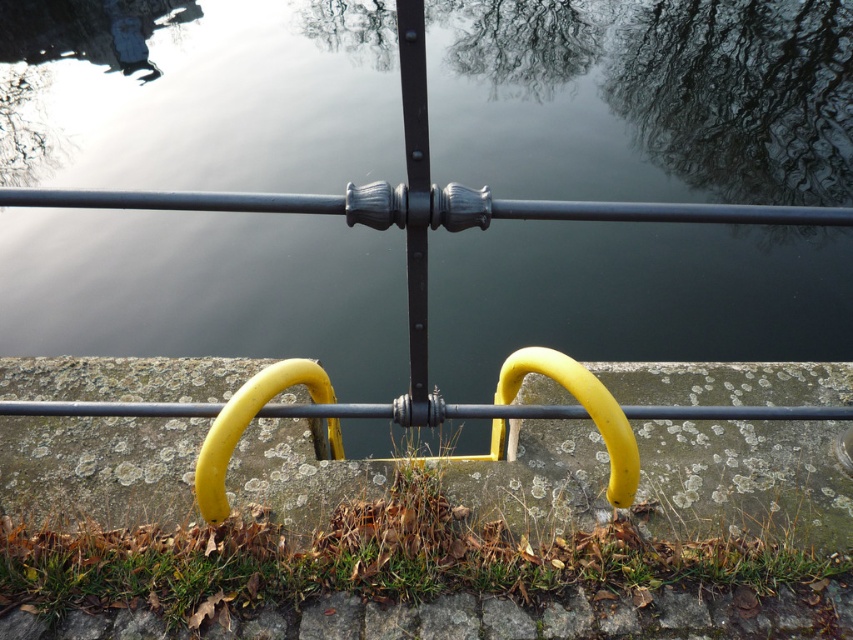
Is glossy dark water at center further to camera compared to green grass at lower center?

Yes, glossy dark water at center is behind green grass at lower center.

Is point (86, 288) behind point (16, 609)?

Yes, it is behind point (16, 609).

Where is `glossy dark water at center`? This screenshot has width=853, height=640. glossy dark water at center is located at coordinates (643, 99).